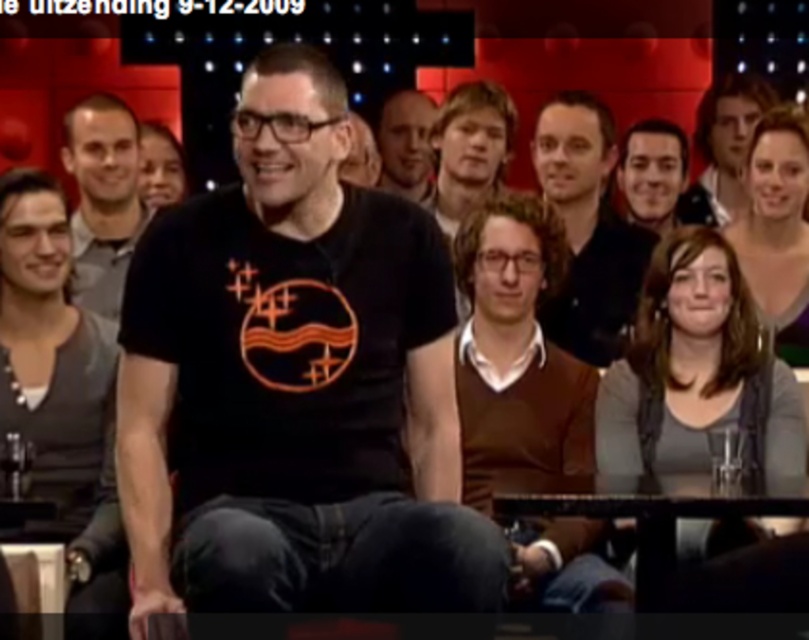
What do you see at coordinates (58, 403) in the screenshot? I see `matte black shirt at left` at bounding box center [58, 403].

Can you confirm if matte black shirt at left is wider than matte black shirt at center?

Yes, matte black shirt at left is wider than matte black shirt at center.

Looking at this image, who is more distant from viewer, [121,540] or [619,296]?

The point [619,296] is behind.

In order to click on matte black shirt at left in this screenshot , I will do `click(58, 403)`.

Is matte black shirt at left to the right of matte black shirt at upper center from the viewer's perspective?

Incorrect, matte black shirt at left is not on the right side of matte black shirt at upper center.

How far apart are matte black shirt at left and matte black shirt at upper center?

matte black shirt at left is 9.84 feet from matte black shirt at upper center.

The image size is (809, 640). Describe the element at coordinates (58, 403) in the screenshot. I see `matte black shirt at left` at that location.

Identify the location of matte black shirt at left. Image resolution: width=809 pixels, height=640 pixels. coord(58,403).

Is matte black shirt at left to the left of matte black shirt at upper right from the viewer's perspective?

Indeed, matte black shirt at left is positioned on the left side of matte black shirt at upper right.

Locate an element on the screen. matte black shirt at left is located at coordinates (58, 403).